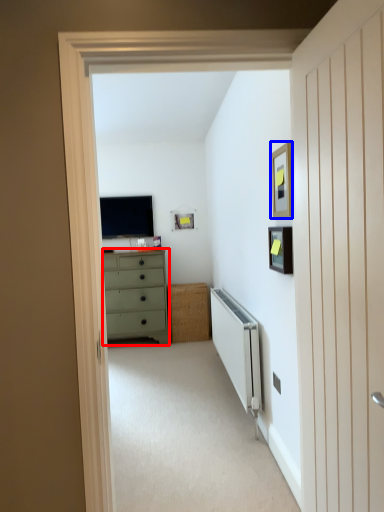
Question: Which object is closer to the camera taking this photo, chest of drawers (highlighted by a red box) or picture frame (highlighted by a blue box)?

Choices:
 (A) chest of drawers
 (B) picture frame

Answer: (B)